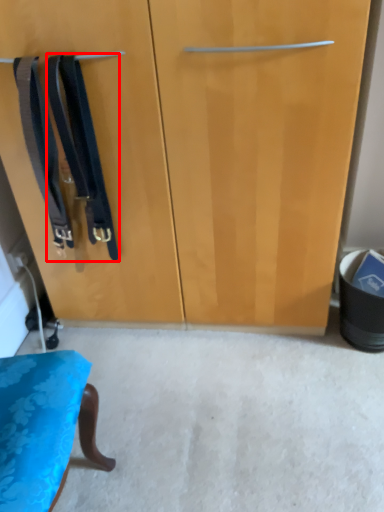
Question: From the image's perspective, where is suspenders (annotated by the red box) located in relation to suspenders in the image?

Choices:
 (A) above
 (B) below

Answer: (B)